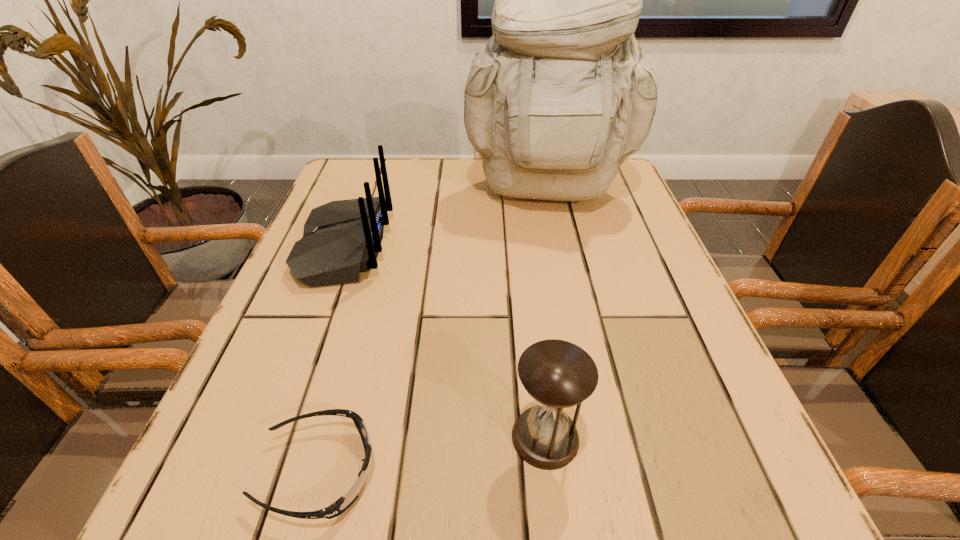
Identify the location of the tallest object. The image size is (960, 540). (562, 93).

Find the location of a particular element. This screenshot has height=540, width=960. the third shortest object is located at coordinates (341, 239).

Identify the location of the third tallest object. The image size is (960, 540). (558, 374).

This screenshot has width=960, height=540. Identify the location of the shortest object. (342, 504).

The height and width of the screenshot is (540, 960). Find the location of `vacant space situated on the front-facing side of the backpack`. vacant space situated on the front-facing side of the backpack is located at coordinates (560, 249).

Where is `free spot located 0.310m on the back of the router`? The width and height of the screenshot is (960, 540). free spot located 0.310m on the back of the router is located at coordinates (538, 247).

Locate an element on the screen. Image resolution: width=960 pixels, height=540 pixels. vacant point located 0.140m on the right of the second shortest object is located at coordinates (682, 437).

Where is `free region located on the lenses of the sunglasses`? free region located on the lenses of the sunglasses is located at coordinates (624, 471).

The height and width of the screenshot is (540, 960). I want to click on object at the far edge, so click(x=562, y=93).

Find the location of a particular element. This screenshot has height=540, width=960. hourglass that is positioned at the near edge is located at coordinates (558, 374).